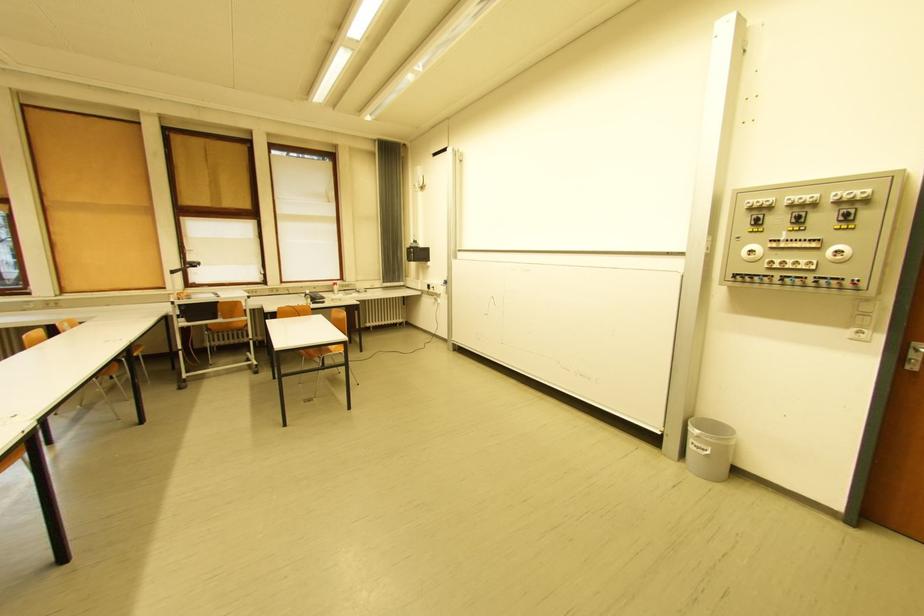
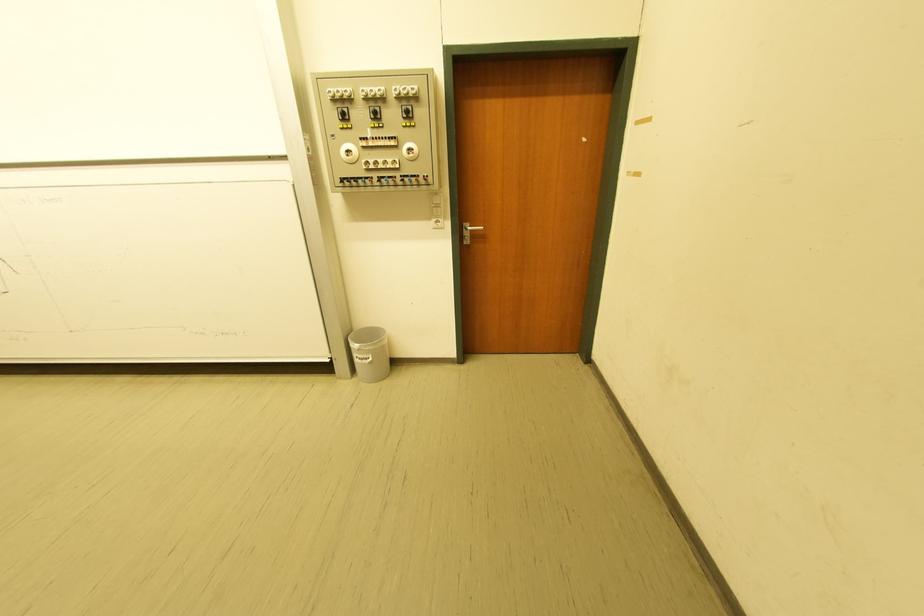
In the second image, find the point that corresponds to (x=703, y=448) in the first image.

(368, 361)